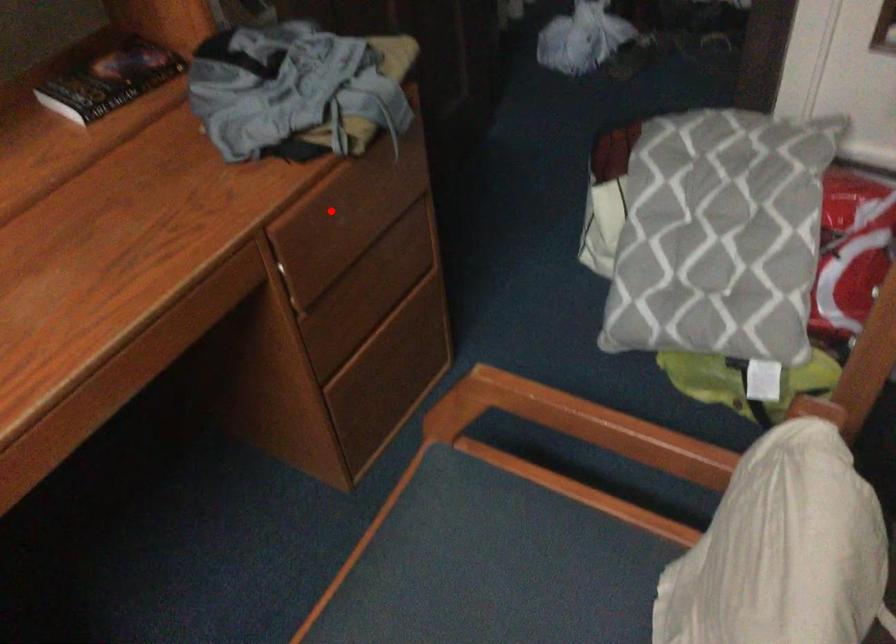
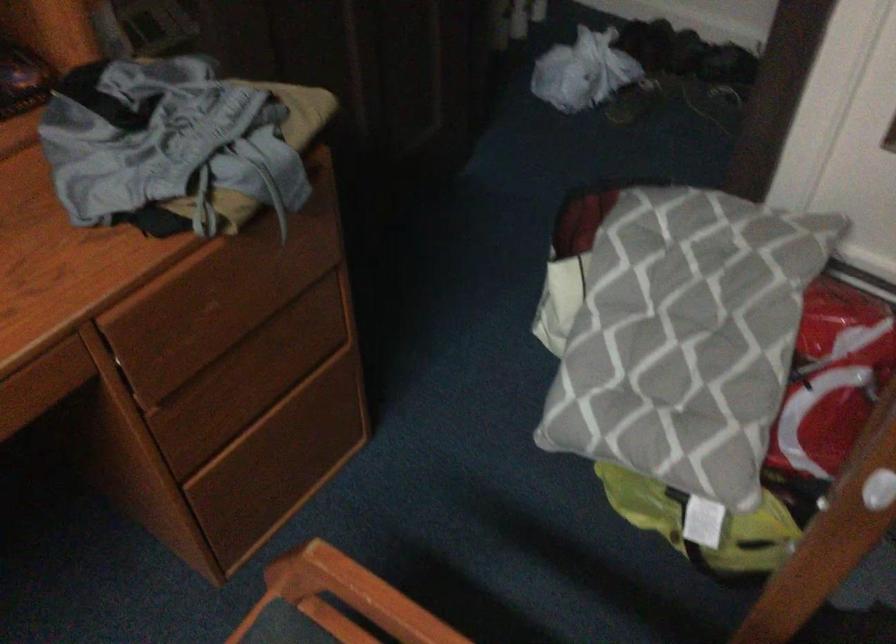
Where in the second image is the point corresponding to the highlighted location from the first image?

(196, 294)